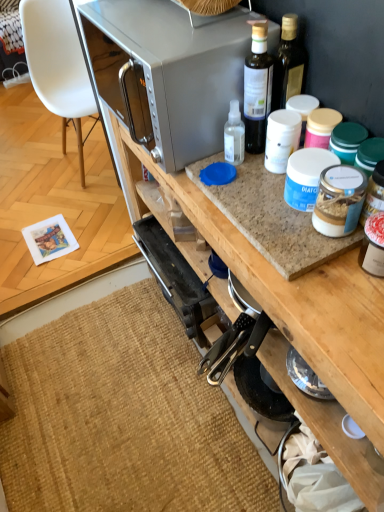
Image resolution: width=384 pixels, height=512 pixels. In order to click on empty space that is ontop of satin silver microwave at upper center (from a real-world perspective) in this screenshot , I will do `click(158, 22)`.